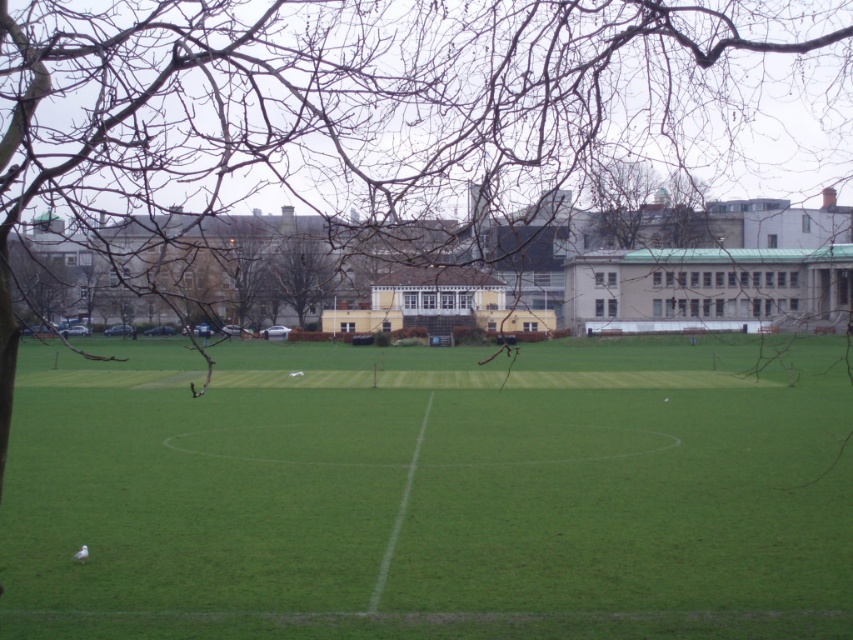
Question: Among these objects, which one is farthest from the camera?

Choices:
 (A) brown leafless tree at center
 (B) green grass field at center

Answer: (B)

Question: Does green grass field at center have a larger size compared to brown leafless tree at center?

Choices:
 (A) yes
 (B) no

Answer: (A)

Question: Which point appears closest to the camera in this image?

Choices:
 (A) pos(119,556)
 (B) pos(293,241)

Answer: (A)

Question: Does green grass field at center have a lesser width compared to brown leafless tree at center?

Choices:
 (A) yes
 (B) no

Answer: (B)

Question: Which point is farther to the camera?

Choices:
 (A) green grass field at center
 (B) brown leafless tree at center

Answer: (A)

Question: Can you confirm if green grass field at center is positioned to the right of brown leafless tree at center?

Choices:
 (A) yes
 (B) no

Answer: (A)